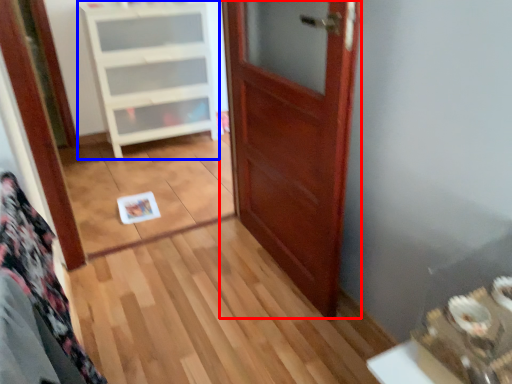
Question: Among these objects, which one is nearest to the camera, door (highlighted by a red box) or cabinetry (highlighted by a blue box)?

Choices:
 (A) door
 (B) cabinetry

Answer: (A)